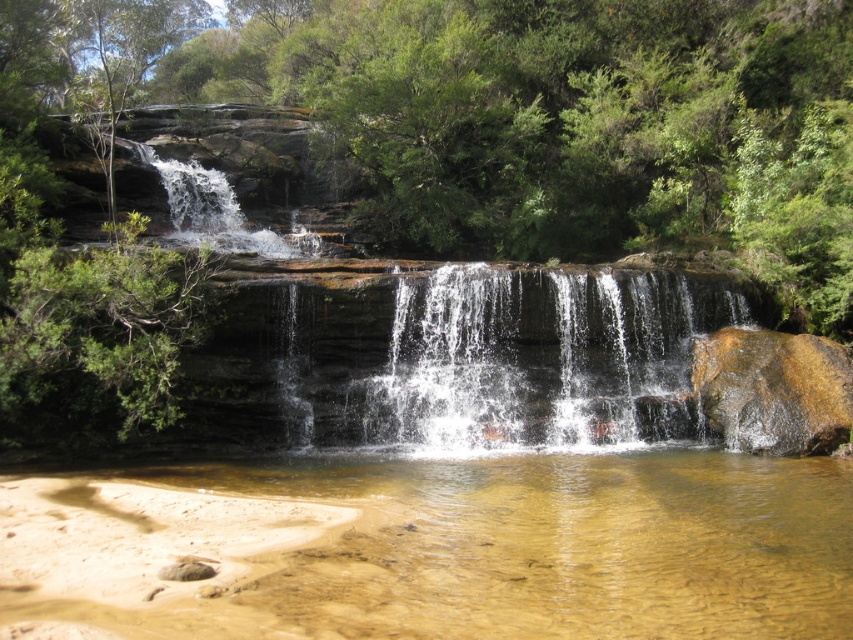
Is clear water at lower center bigger than brown rough rock at right?

Yes, clear water at lower center is bigger than brown rough rock at right.

Is the position of clear water at lower center less distant than that of brown rough rock at right?

Yes, it is.

You are a GUI agent. You are given a task and a screenshot of the screen. Output one action in this format:
    pyautogui.click(x=<x>, y=<y>)
    Task: Click on the clear water at lower center
    
    Given the screenshot: What is the action you would take?
    pyautogui.click(x=535, y=552)

Who is higher up, clear water at center or brown rough rock at right?

clear water at center

Between point (672, 301) and point (715, 385), which one is positioned in front?

Point (715, 385)

At what (x,y) coordinates should I click in order to perform the action: click on clear water at center. Please return your answer as a coordinate pair (x, y). The height and width of the screenshot is (640, 853). Looking at the image, I should click on (537, 358).

Is clear water at lower center closer to the viewer compared to clear water at center?

Yes.

Looking at this image, is clear water at lower center thinner than clear water at center?

Incorrect, clear water at lower center's width is not less than clear water at center's.

Is point (732, 500) positioned behind point (427, 426)?

No, it is not.

At what (x,y) coordinates should I click in order to perform the action: click on clear water at lower center. Please return your answer as a coordinate pair (x, y). The width and height of the screenshot is (853, 640). Looking at the image, I should click on (535, 552).